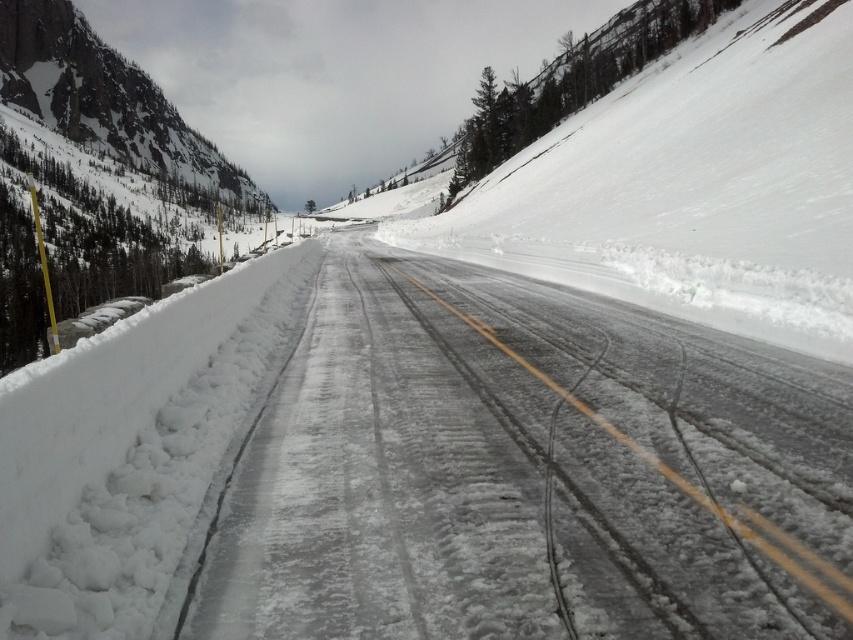
You are a delivery driver navigating a narrow mountain road. You see the snowy asphalt road at center and the snowy rock cliff at upper left. Which path is narrower?

The snowy asphalt road at center is thinner than the snowy rock cliff at upper left, so the road is narrower than the cliff.

You are a hiker planning to cross the snowy asphalt road at center and the snowy rock cliff at upper left. Which path would you choose to avoid the steep slope?

The snowy asphalt road at center is positioned on the right side of snowy rock cliff at upper left, so the snowy asphalt road at center is likely flatter and safer to cross than the snowy rock cliff at upper left which has a steep slope.

You are a driver navigating a snowy mountain road. You see the snowy asphalt road at center and the snowy rock cliff at upper left. Which one is closer to you?

The snowy asphalt road at center is closer to you because it is shorter than the snowy rock cliff at upper left.